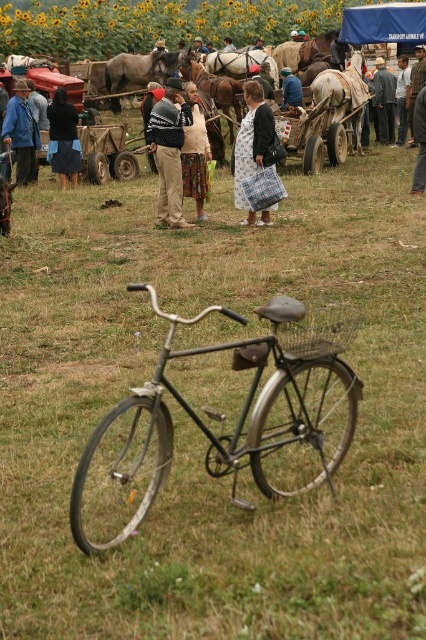
Which of these two, white glossy horse at upper center or light blue denim jacket at center, stands shorter?

With less height is white glossy horse at upper center.

How far apart are white glossy horse at upper center and light blue denim jacket at center?

4.98 meters

Find the location of a particular element. This screenshot has width=426, height=640. white glossy horse at upper center is located at coordinates (238, 61).

Is wooden-patterned vest at center to the left of white glossy horse at upper center from the viewer's perspective?

Indeed, wooden-patterned vest at center is positioned on the left side of white glossy horse at upper center.

Image resolution: width=426 pixels, height=640 pixels. Find the location of `wooden-patterned vest at center`. wooden-patterned vest at center is located at coordinates (195, 154).

Which is more to the right, matte black bicycle at center or light blue denim jacket at center?

From the viewer's perspective, light blue denim jacket at center appears more on the right side.

Can you confirm if matte black bicycle at center is smaller than light blue denim jacket at center?

No.

Locate an element on the screen. Image resolution: width=426 pixels, height=640 pixels. matte black bicycle at center is located at coordinates (222, 422).

Find the location of a particular element. The image size is (426, 640). matte black bicycle at center is located at coordinates (222, 422).